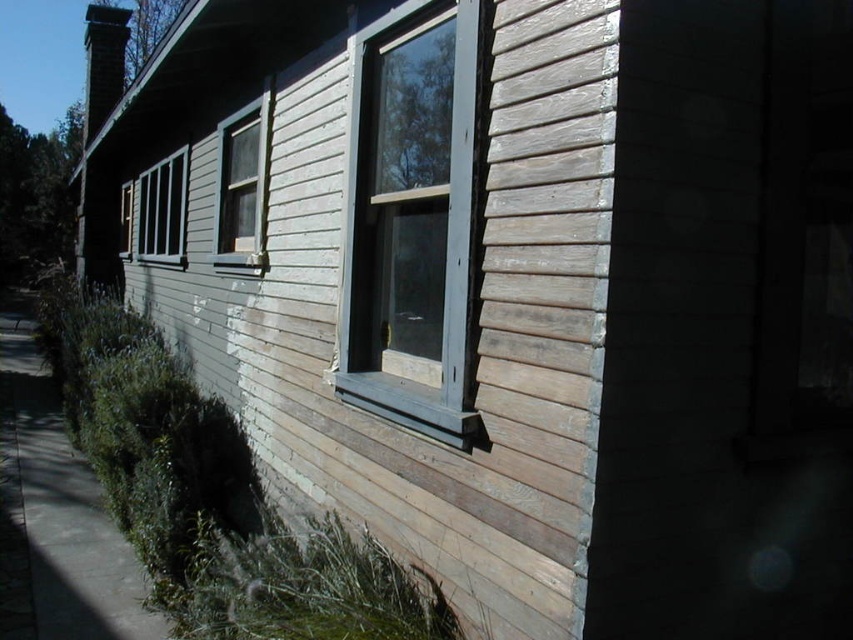
You are a window installer assessing the house. You need to replace the smaller of the two clear glass windows. Which window should you choose between the clear glass window at upper left and the clear glass window at left?

The clear glass window at upper left is smaller than the clear glass window at left, so you should choose the clear glass window at upper left to replace.

You are standing in front of a wooden house with weathered siding. You notice a point at coordinates (410, 220). Based on the scene description, which object is located at this point?

The point at coordinates (410, 220) corresponds to the wooden frame window at center.

You are a delivery person approaching the house and need to locate the clear glass window at upper left and the matte wood window at left. Which window is positioned lower on the house?

The clear glass window at upper left is located below the matte wood window at left, so the clear glass window at upper left is positioned lower on the house.